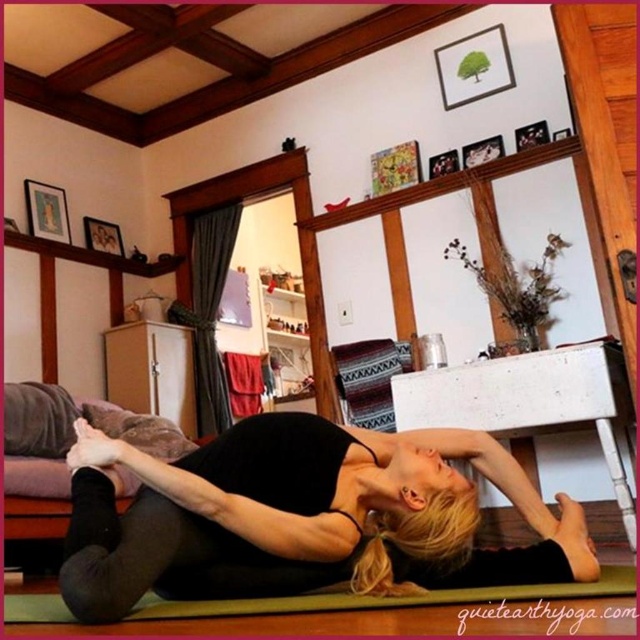
Can you confirm if black matte yoga mat at center is positioned to the right of green rubber yoga mat at lower center?

Correct, you'll find black matte yoga mat at center to the right of green rubber yoga mat at lower center.

Does point (445, 481) lie behind point (374, 600)?

That is True.

Between point (337, 456) and point (292, 605), which one is positioned behind?

The point (337, 456) is more distant.

Image resolution: width=640 pixels, height=640 pixels. Identify the location of black matte yoga mat at center. (300, 516).